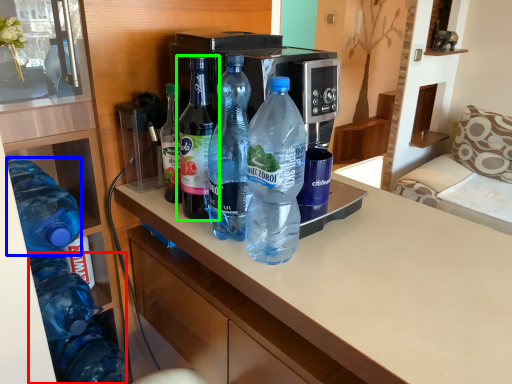
Question: Which object is the farthest from bottle (highlighted by a red box)? Choose among these: bottle (highlighted by a blue box) or bottle (highlighted by a green box).

Choices:
 (A) bottle
 (B) bottle

Answer: (B)